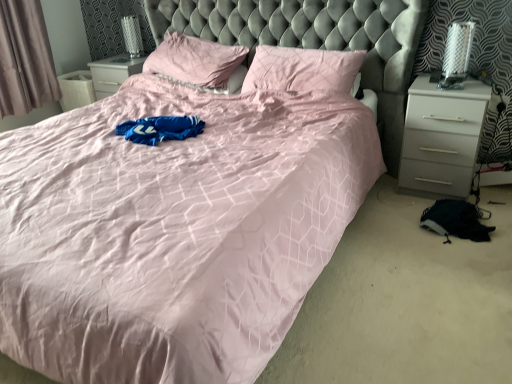
Question: Considering the positions of point 15,59 and point 281,46, is point 15,59 closer or farther from the camera than point 281,46?

Choices:
 (A) farther
 (B) closer

Answer: (A)

Question: From the image's perspective, is gray fabric curtain at left above or below pink satin pillow at upper center, which appears as the second pillow when viewed from the left?

Choices:
 (A) below
 (B) above

Answer: (B)

Question: Which is farther from the gray fabric curtain at left?

Choices:
 (A) pink satin pillow at upper center, which appears as the second pillow when viewed from the left
 (B) white glossy nightstand at right
 (C) pink fabric pillow at center, which is the second pillow in right-to-left order

Answer: (B)

Question: Which object is positioned closest to the pink fabric pillow at center, which is the 1th pillow from left to right?

Choices:
 (A) white glossy nightstand at right
 (B) gray fabric curtain at left
 (C) pink satin pillow at upper center, arranged as the first pillow when viewed from the right

Answer: (C)